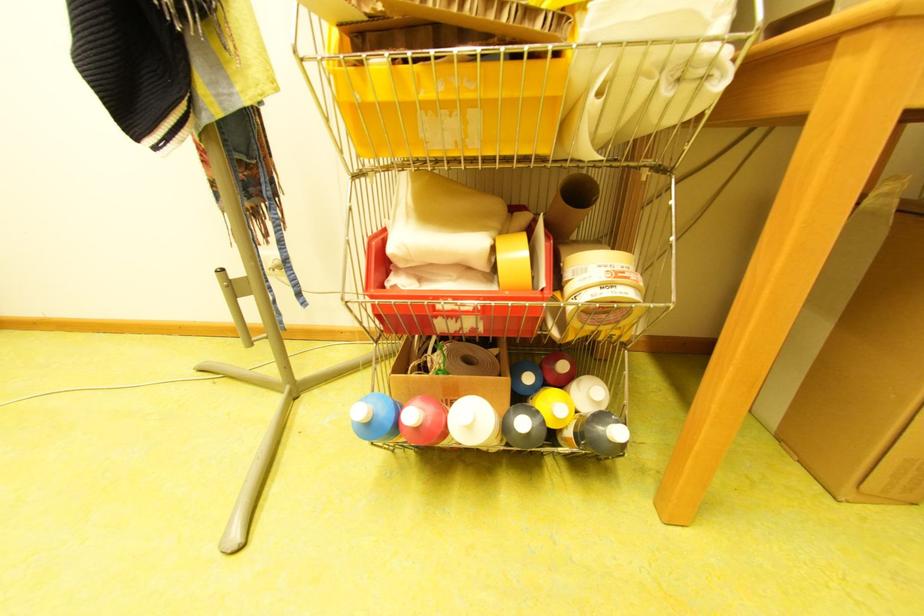
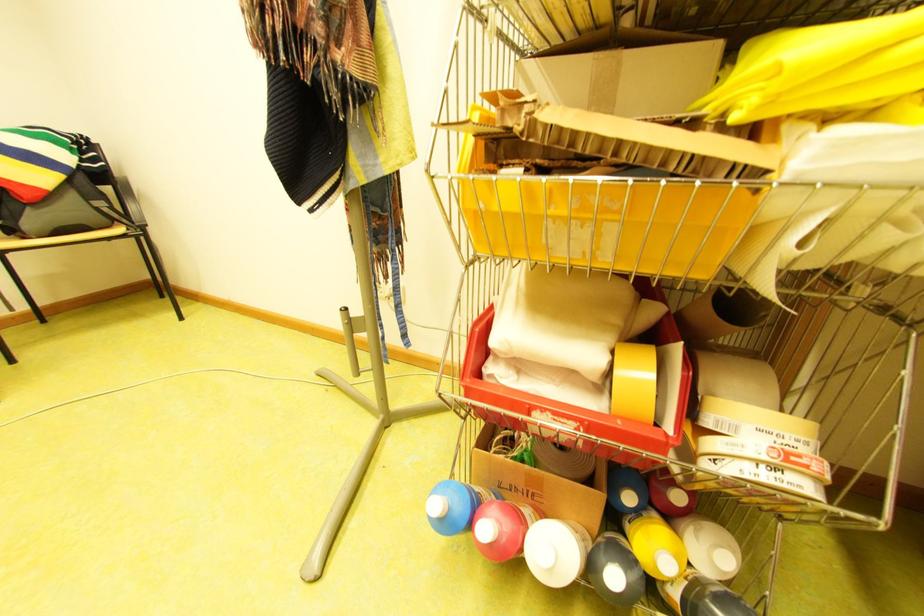
The point at (611, 267) is marked in the first image. Where is the corresponding point in the second image?

(772, 432)